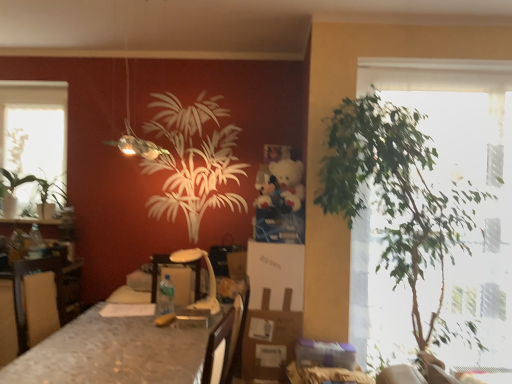
Question: From the image's perspective, is green leafy plant at left over clear glass window at upper left?

Choices:
 (A) yes
 (B) no

Answer: (B)

Question: Is green leafy plant at left positioned beyond the bounds of clear glass window at upper left?

Choices:
 (A) yes
 (B) no

Answer: (A)

Question: Is green leafy plant at left taller than clear glass window at upper left?

Choices:
 (A) no
 (B) yes

Answer: (A)

Question: Is green leafy plant at left at the right side of clear glass window at upper left?

Choices:
 (A) no
 (B) yes

Answer: (A)

Question: Is clear glass window at upper left at the back of green leafy plant at left?

Choices:
 (A) yes
 (B) no

Answer: (A)

Question: From the image's perspective, relative to green leafy plant at left, is green leafy plant at left, the second houseplant viewed from the front, above or below?

Choices:
 (A) below
 (B) above

Answer: (A)

Question: Looking at their shapes, would you say green leafy plant at left, which appears as the first houseplant when viewed from the back, is wider or thinner than green leafy plant at left?

Choices:
 (A) wide
 (B) thin

Answer: (A)

Question: In terms of size, does green leafy plant at left, which appears as the first houseplant when viewed from the back, appear bigger or smaller than green leafy plant at left?

Choices:
 (A) big
 (B) small

Answer: (A)

Question: Relative to green leafy plant at left, is green leafy plant at left, which appears as the first houseplant when viewed from the back, in front or behind?

Choices:
 (A) front
 (B) behind

Answer: (A)

Question: Looking at the image, does clear glass window at upper left seem bigger or smaller compared to green leafy plant at left?

Choices:
 (A) big
 (B) small

Answer: (B)

Question: Is point (19, 211) positioned closer to the camera than point (18, 134)?

Choices:
 (A) closer
 (B) farther

Answer: (A)

Question: Choose the correct answer: Is clear glass window at upper left inside green leafy plant at left or outside it?

Choices:
 (A) inside
 (B) outside

Answer: (B)

Question: From a real-world perspective, relative to green leafy plant at left, is clear glass window at upper left vertically above or below?

Choices:
 (A) below
 (B) above

Answer: (B)

Question: Considering the positions of point (10, 190) and point (98, 339), is point (10, 190) closer or farther from the camera than point (98, 339)?

Choices:
 (A) farther
 (B) closer

Answer: (A)

Question: Would you say green leafy plant at left, which appears as the first houseplant when viewed from the back, is inside or outside marble-patterned table at center?

Choices:
 (A) inside
 (B) outside

Answer: (B)